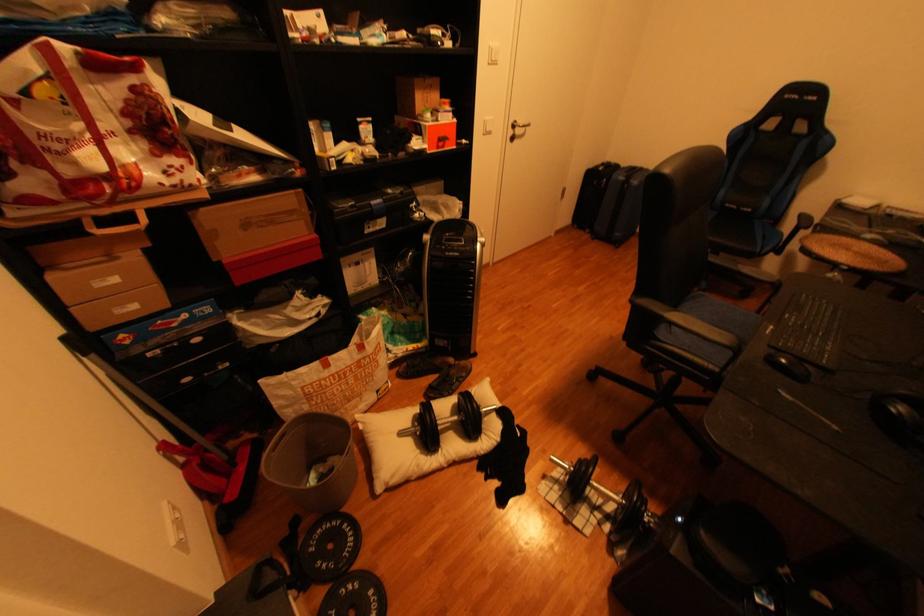
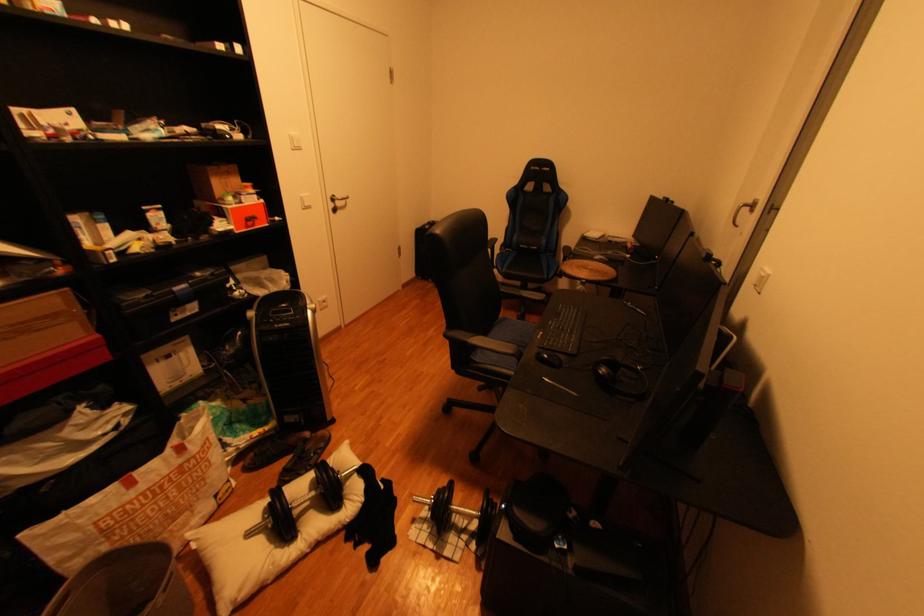
In the second image, find the point that corresponds to the point at 736,205 in the first image.

(531, 246)